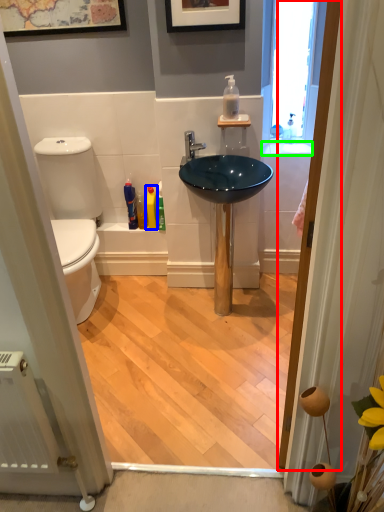
Question: Which object is positioned closest to door (highlighted by a red box)? Select from toiletry (highlighted by a blue box) and counter top (highlighted by a green box).

Choices:
 (A) toiletry
 (B) counter top

Answer: (B)